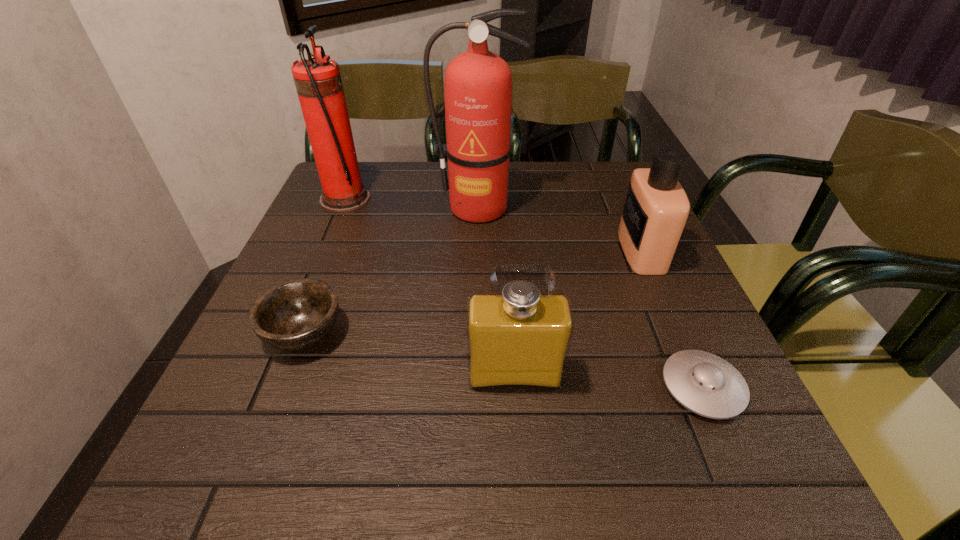
Identify the location of free space at the far edge of the desktop. (428, 178).

Locate an element on the screen. Image resolution: width=960 pixels, height=540 pixels. free space at the left edge is located at coordinates (256, 372).

Where is `vacant space at the far left corner of the desktop`? vacant space at the far left corner of the desktop is located at coordinates (381, 181).

Locate an element on the screen. vacant space at the near left corner of the desktop is located at coordinates (189, 473).

The width and height of the screenshot is (960, 540). In the image, there is a desktop. What are the coordinates of `vacant space at the far right corner` in the screenshot? It's located at (575, 179).

This screenshot has width=960, height=540. Identify the location of free space between the bowl and the left fire extinguisher. (324, 266).

Locate an element on the screen. This screenshot has width=960, height=540. free space between the left fire extinguisher and the right fire extinguisher is located at coordinates point(411,204).

Where is `vacant area between the nearer perfume and the second shortest object`? The width and height of the screenshot is (960, 540). vacant area between the nearer perfume and the second shortest object is located at coordinates (409, 354).

The image size is (960, 540). I want to click on free point between the left fire extinguisher and the fifth tallest object, so click(x=324, y=266).

Image resolution: width=960 pixels, height=540 pixels. Find the location of `vacant space that's between the nearer perfume and the left fire extinguisher`. vacant space that's between the nearer perfume and the left fire extinguisher is located at coordinates (430, 287).